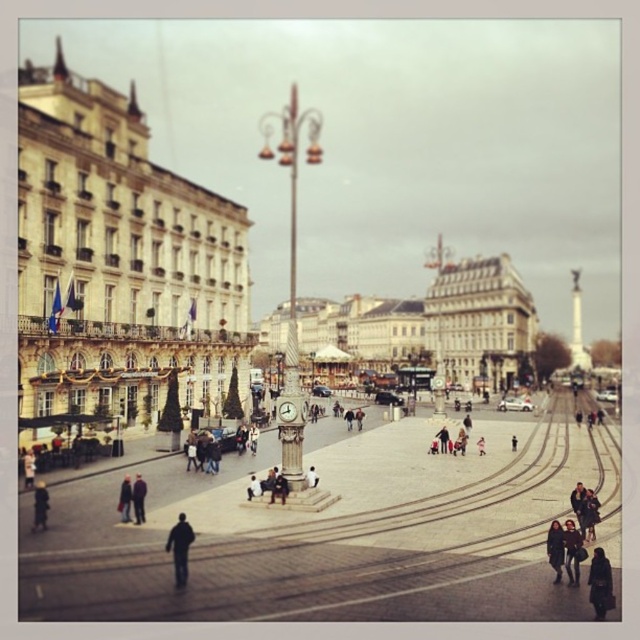
Consider the image. Between smooth concrete plaza at center and dark blue coat at lower right, which one is positioned lower?

dark blue coat at lower right is below.

Which is behind, point (369, 490) or point (547, 541)?

The point (369, 490) is behind.

This screenshot has height=640, width=640. Find the location of `smooth concrete plaza at center`. smooth concrete plaza at center is located at coordinates (339, 531).

Which of these two, white stone building at center or dark blue coat at lower right, stands shorter?

Standing shorter between the two is dark blue coat at lower right.

Is white stone building at center wider than dark blue coat at lower right?

Yes.

Is point (492, 291) more distant than point (547, 547)?

Yes, point (492, 291) is farther from viewer.

Where is `white stone building at center`? The image size is (640, 640). white stone building at center is located at coordinates (436, 324).

Is dark blue jacket at lower left wider than dark blue jeans at center?

Yes.

Describe the element at coordinates (40, 506) in the screenshot. Image resolution: width=640 pixels, height=640 pixels. I see `dark blue jacket at lower left` at that location.

Where is `dark blue jacket at lower left`? This screenshot has height=640, width=640. dark blue jacket at lower left is located at coordinates (40, 506).